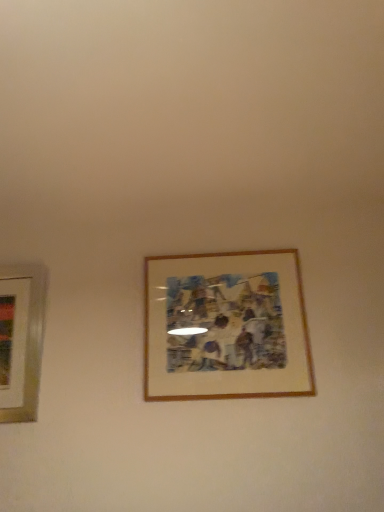
Question: Considering the positions of matte white picture frame at left, the first picture frame viewed from the left, and wooden-framed artwork at center, which is counted as the second picture frame, starting from the left, in the image, is matte white picture frame at left, the first picture frame viewed from the left, taller or shorter than wooden-framed artwork at center, which is counted as the second picture frame, starting from the left,?

Choices:
 (A) short
 (B) tall

Answer: (B)

Question: In terms of width, does matte white picture frame at left, the first picture frame viewed from the left, look wider or thinner when compared to wooden-framed artwork at center, acting as the 1th picture frame starting from the right?

Choices:
 (A) wide
 (B) thin

Answer: (A)

Question: Is matte white picture frame at left, the first picture frame viewed from the left, spatially inside wooden-framed artwork at center, which is counted as the second picture frame, starting from the left, or outside of it?

Choices:
 (A) outside
 (B) inside

Answer: (A)

Question: From a real-world perspective, relative to matte white picture frame at left, which ranks as the second picture frame in right-to-left order, is wooden-framed artwork at center, acting as the 1th picture frame starting from the right, vertically above or below?

Choices:
 (A) above
 (B) below

Answer: (A)

Question: Considering their positions, is wooden-framed artwork at center, acting as the 1th picture frame starting from the right, located in front of or behind matte white picture frame at left, the first picture frame viewed from the left?

Choices:
 (A) front
 (B) behind

Answer: (A)

Question: In terms of size, does wooden-framed artwork at center, which is counted as the second picture frame, starting from the left, appear bigger or smaller than matte white picture frame at left, which ranks as the second picture frame in right-to-left order?

Choices:
 (A) small
 (B) big

Answer: (B)

Question: From the image's perspective, is wooden-framed artwork at center, which is counted as the second picture frame, starting from the left, above or below matte white picture frame at left, which ranks as the second picture frame in right-to-left order?

Choices:
 (A) above
 (B) below

Answer: (A)